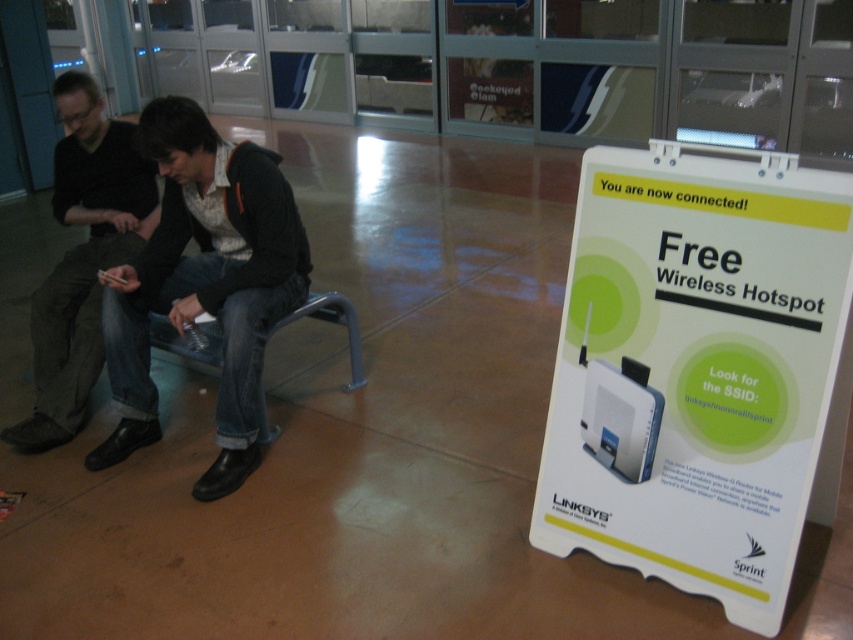
You are a person standing in the scene and want to know which item is taller between the jeans at left and the dark brown leather shoes at lower left. Which one is taller?

The jeans at left is not as tall as dark brown leather shoes at lower left, so the dark brown leather shoes at lower left are taller.

You are standing in the public space and want to take a photo of the jeans at left without including the dark brown leather shoes at lower left in the frame. Is this possible based on their positions?

The jeans at left is in front of the dark brown leather shoes at lower left, so taking a photo of the jeans at left without including the dark brown leather shoes at lower left would require adjusting the camera angle to exclude the shoes behind them.